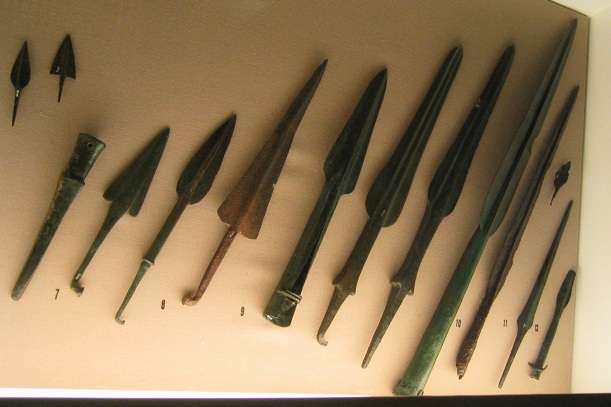
The width and height of the screenshot is (611, 407). I want to click on white table top surface, so click(x=588, y=5), click(x=601, y=206), click(x=87, y=394).